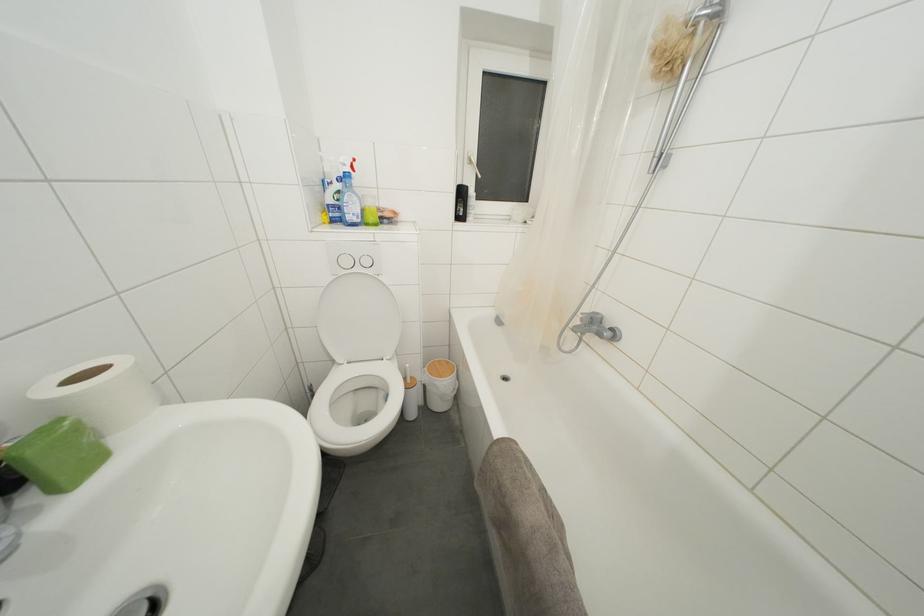
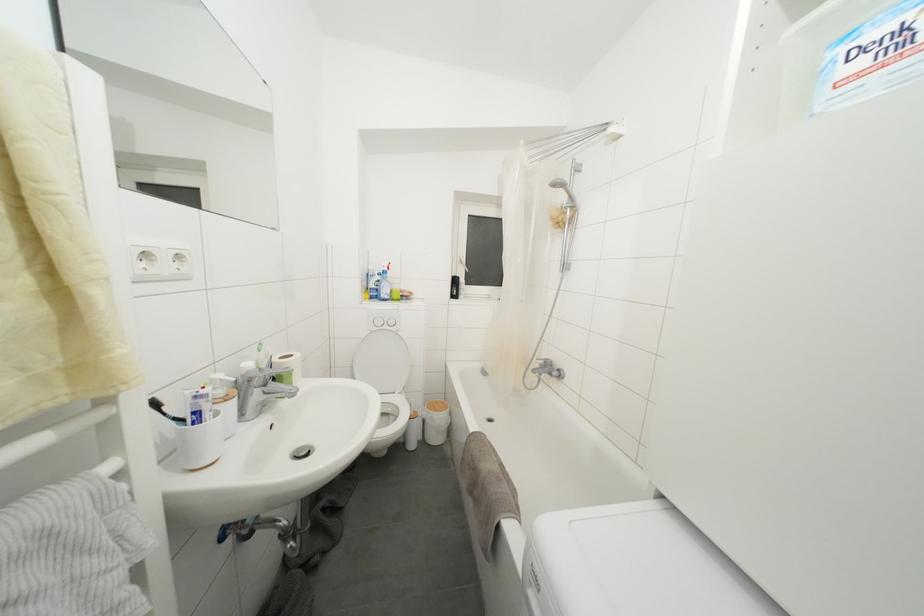
Question: What movement of the cameraman would produce the second image?

Choices:
 (A) Left
 (B) Right
 (C) Forward
 (D) Backward

Answer: (D)